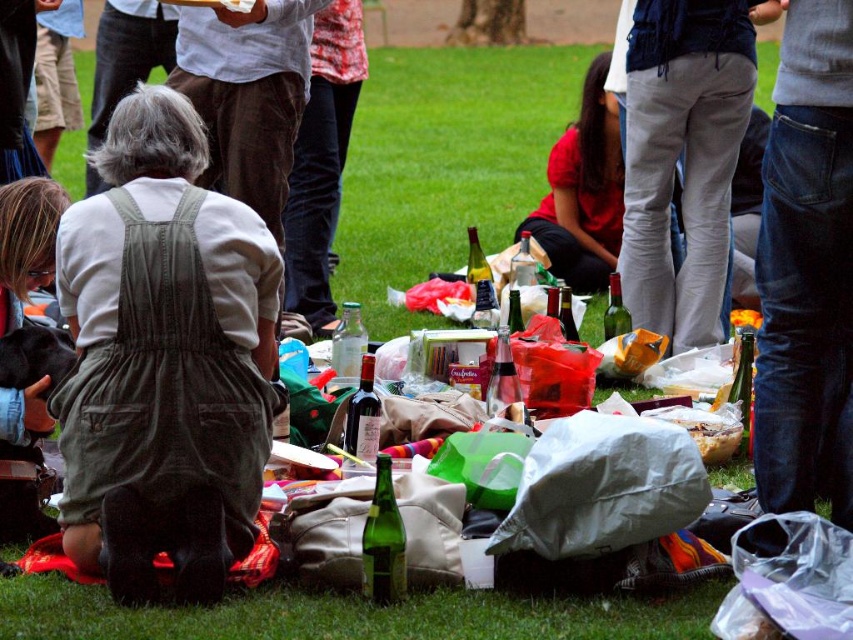
At what (x,y) coordinates should I click in order to perform the action: click on green corduroy overalls at center. Please return your answer as a coordinate pair (x, y). This screenshot has height=640, width=853. Looking at the image, I should click on (163, 358).

Who is more distant from viewer, (x=225, y=465) or (x=688, y=259)?

Point (x=688, y=259)

Find the location of a particular element. green corduroy overalls at center is located at coordinates (163, 358).